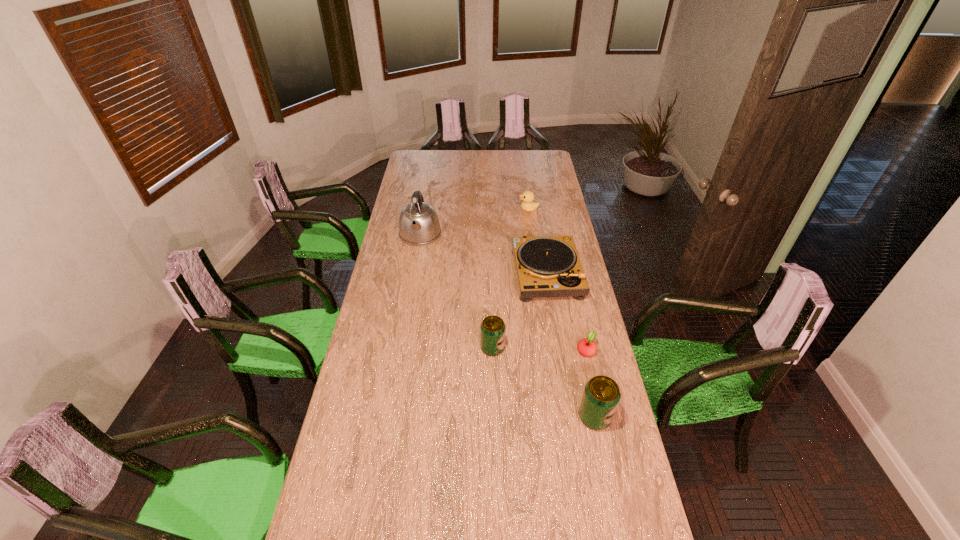
Identify the location of free point that keeps the beer cans evenly spaced on the left. (414, 294).